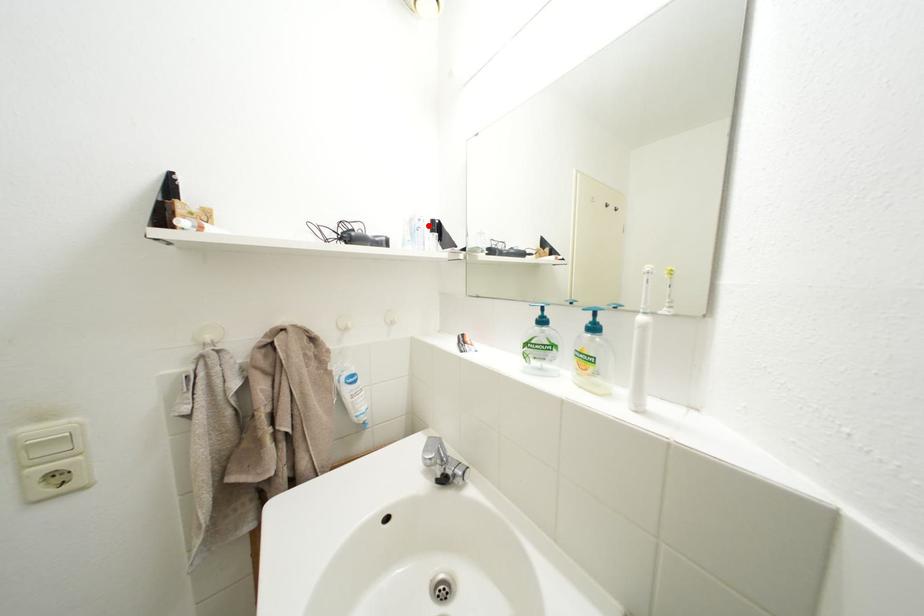
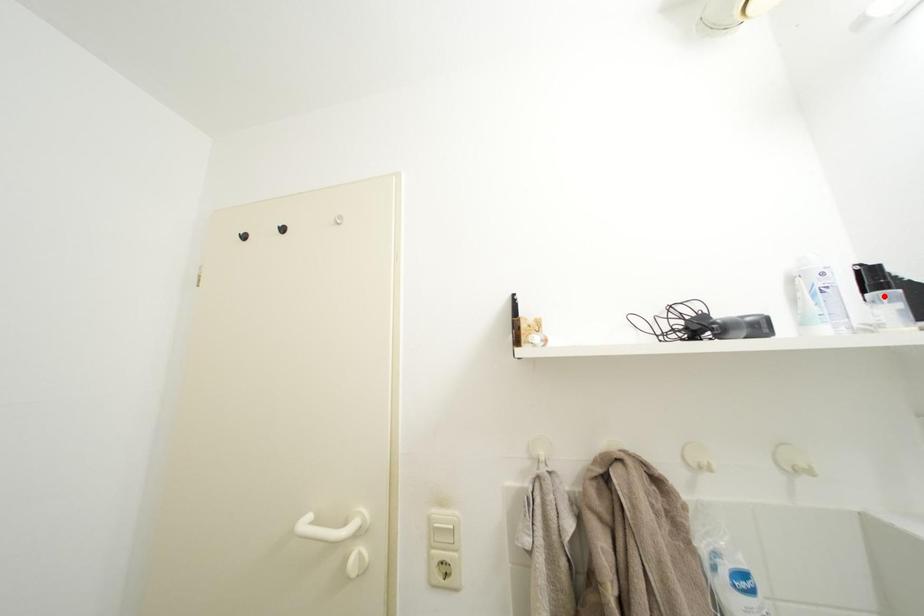
I am providing you with two images of the same scene from different viewpoints. A red point is marked on the first image and another point is marked on the second image. Is the red point in image1 aligned with the point shown in image2?

No